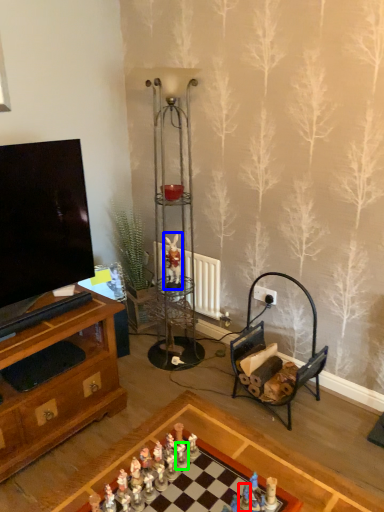
Question: Which object is the closest to the toy (highlighted by a red box)? Choose among these: miniature (highlighted by a blue box) or toy (highlighted by a green box).

Choices:
 (A) miniature
 (B) toy

Answer: (B)